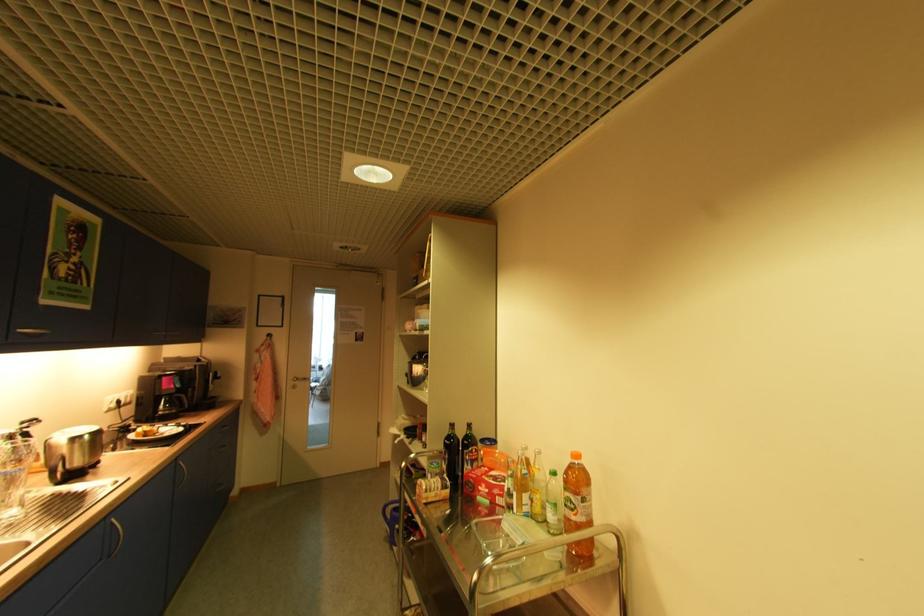
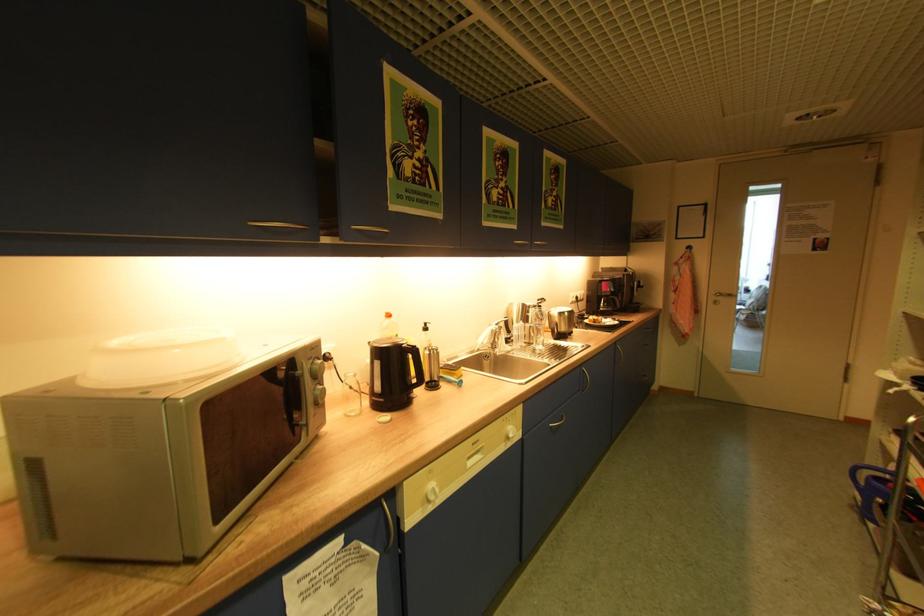
Question: The camera is either moving clockwise (left) or counter-clockwise (right) around the object. The first image is from the beginning of the video and the second image is from the end. Is the camera moving left or right when shooting the video?

Choices:
 (A) Left
 (B) Right

Answer: (B)